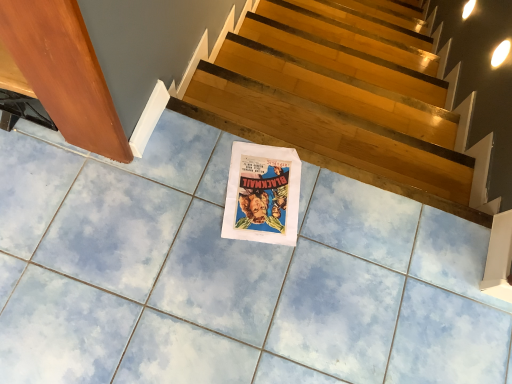
At what (x,y) coordinates should I click in order to perform the action: click on free location above wooden at upper center (from a real-world perspective). Please return your answer as a coordinate pair (x, y). The height and width of the screenshot is (384, 512). Looking at the image, I should click on (331, 130).